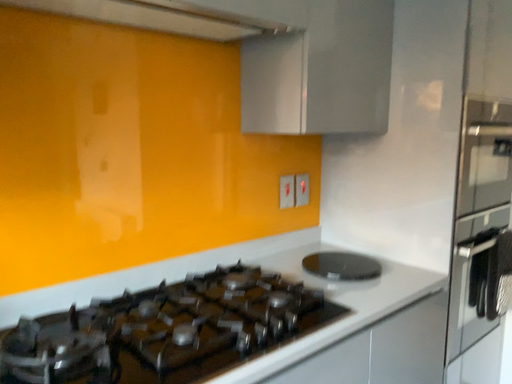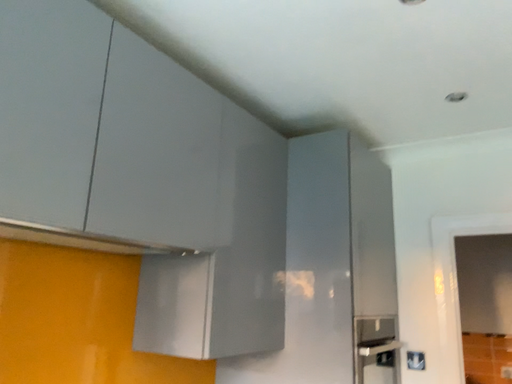
Question: How did the camera likely rotate when shooting the video?

Choices:
 (A) rotated right
 (B) rotated left

Answer: (A)